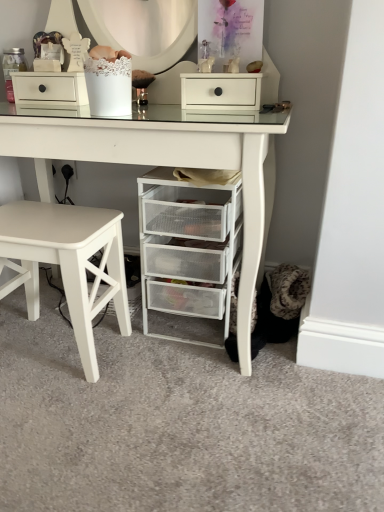
Identify the location of vacant space situated above white matte drawer at upper center (from a real-world perspective). coord(220,71).